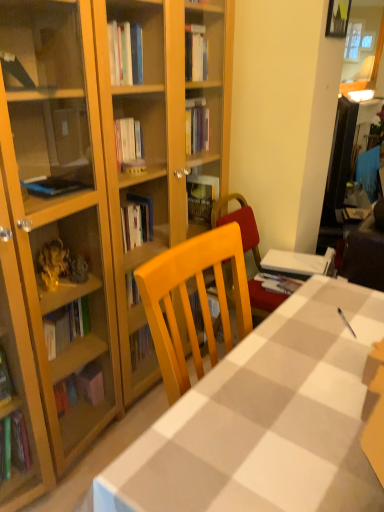
Question: Are wooden picture frame at upper right and white checkered tablecloth at center beside each other?

Choices:
 (A) no
 (B) yes

Answer: (A)

Question: Can you confirm if wooden picture frame at upper right is shorter than white checkered tablecloth at center?

Choices:
 (A) no
 (B) yes

Answer: (B)

Question: From the image's perspective, is wooden picture frame at upper right over white checkered tablecloth at center?

Choices:
 (A) yes
 (B) no

Answer: (A)

Question: Is wooden picture frame at upper right turned away from white checkered tablecloth at center?

Choices:
 (A) yes
 (B) no

Answer: (B)

Question: Can you confirm if wooden picture frame at upper right is positioned to the left of white checkered tablecloth at center?

Choices:
 (A) no
 (B) yes

Answer: (A)

Question: Can you confirm if wooden picture frame at upper right is taller than white checkered tablecloth at center?

Choices:
 (A) no
 (B) yes

Answer: (A)

Question: Could you tell me if white checkered tablecloth at center is facing wooden picture frame at upper right?

Choices:
 (A) yes
 (B) no

Answer: (B)

Question: Does white checkered tablecloth at center appear on the left side of wooden picture frame at upper right?

Choices:
 (A) no
 (B) yes

Answer: (B)

Question: From the image's perspective, is white checkered tablecloth at center located above wooden picture frame at upper right?

Choices:
 (A) no
 (B) yes

Answer: (A)

Question: Is white checkered tablecloth at center in contact with wooden picture frame at upper right?

Choices:
 (A) yes
 (B) no

Answer: (B)

Question: Does white checkered tablecloth at center have a lesser height compared to wooden picture frame at upper right?

Choices:
 (A) no
 (B) yes

Answer: (A)

Question: Is white checkered tablecloth at center not inside wooden picture frame at upper right?

Choices:
 (A) no
 (B) yes

Answer: (B)

Question: Would you say wooden picture frame at upper right is to the left or to the right of white checkered tablecloth at center in the picture?

Choices:
 (A) right
 (B) left

Answer: (A)